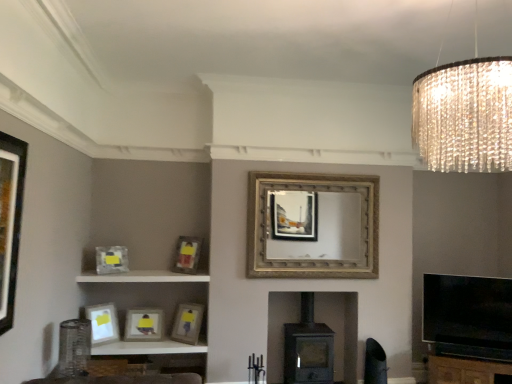
Question: From a real-world perspective, is matte wooden picture frame at lower center, the fourth picture frame viewed from the right, below gold textured mirror at center, the 4th picture frame when ordered from back to front?

Choices:
 (A) no
 (B) yes

Answer: (B)

Question: Considering the relative sizes of matte wooden picture frame at lower center, marked as the 4th picture frame in a left-to-right arrangement, and gold textured mirror at center, which is the 4th picture frame in front-to-back order, in the image provided, is matte wooden picture frame at lower center, marked as the 4th picture frame in a left-to-right arrangement, thinner than gold textured mirror at center, which is the 4th picture frame in front-to-back order,?

Choices:
 (A) yes
 (B) no

Answer: (B)

Question: Is matte wooden picture frame at lower center, marked as the 4th picture frame in a left-to-right arrangement, outside gold textured mirror at center, the 4th picture frame when ordered from back to front?

Choices:
 (A) no
 (B) yes

Answer: (B)

Question: Does matte wooden picture frame at lower center, the fourth picture frame viewed from the right, have a lesser height compared to gold textured mirror at center, the 4th picture frame when ordered from back to front?

Choices:
 (A) yes
 (B) no

Answer: (A)

Question: From the image's perspective, does matte wooden picture frame at lower center, placed as the seventh picture frame when sorted from front to back, appear higher than gold textured mirror at center, the 4th picture frame when ordered from back to front?

Choices:
 (A) yes
 (B) no

Answer: (B)

Question: Considering the relative sizes of matte wooden picture frame at lower center, marked as the 4th picture frame in a left-to-right arrangement, and gold textured mirror at center, which is the 4th picture frame in front-to-back order, in the image provided, is matte wooden picture frame at lower center, marked as the 4th picture frame in a left-to-right arrangement, wider than gold textured mirror at center, which is the 4th picture frame in front-to-back order,?

Choices:
 (A) yes
 (B) no

Answer: (A)

Question: Does matte black picture frame at left, which is counted as the 5th picture frame, starting from the right, come behind brown wooden dresser at lower right?

Choices:
 (A) yes
 (B) no

Answer: (B)

Question: Does matte black picture frame at left, which is the 7th picture frame in back-to-front order, have a smaller size compared to brown wooden dresser at lower right?

Choices:
 (A) yes
 (B) no

Answer: (A)

Question: Is matte black picture frame at left, which is the 7th picture frame in back-to-front order, wider than brown wooden dresser at lower right?

Choices:
 (A) yes
 (B) no

Answer: (B)

Question: Is matte black picture frame at left, which is the 7th picture frame in back-to-front order, far from brown wooden dresser at lower right?

Choices:
 (A) yes
 (B) no

Answer: (A)

Question: Is matte black picture frame at left, the 1th picture frame in the front-to-back sequence, bigger than brown wooden dresser at lower right?

Choices:
 (A) yes
 (B) no

Answer: (B)

Question: Is matte black picture frame at left, which is the 7th picture frame in back-to-front order, to the right of brown wooden dresser at lower right from the viewer's perspective?

Choices:
 (A) yes
 (B) no

Answer: (B)

Question: Considering the relative positions of matte white picture frame at lower left, which appears as the sixth picture frame when viewed from the back, and matte gray picture frame at left, the 2th picture frame in the left-to-right sequence, in the image provided, is matte white picture frame at lower left, which appears as the sixth picture frame when viewed from the back, to the right of matte gray picture frame at left, the 2th picture frame in the left-to-right sequence, from the viewer's perspective?

Choices:
 (A) yes
 (B) no

Answer: (B)